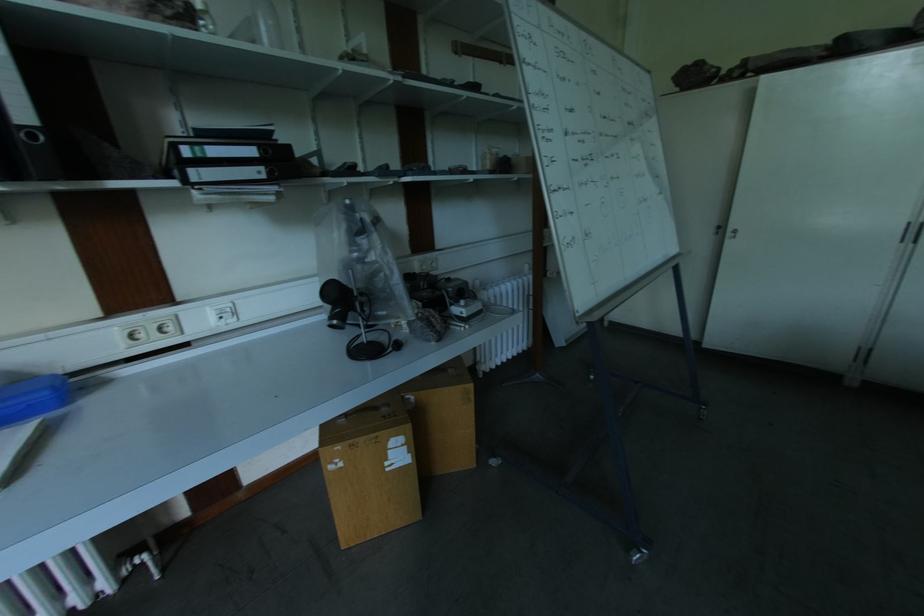
Identify the location of cardboard box handle. (362, 410).